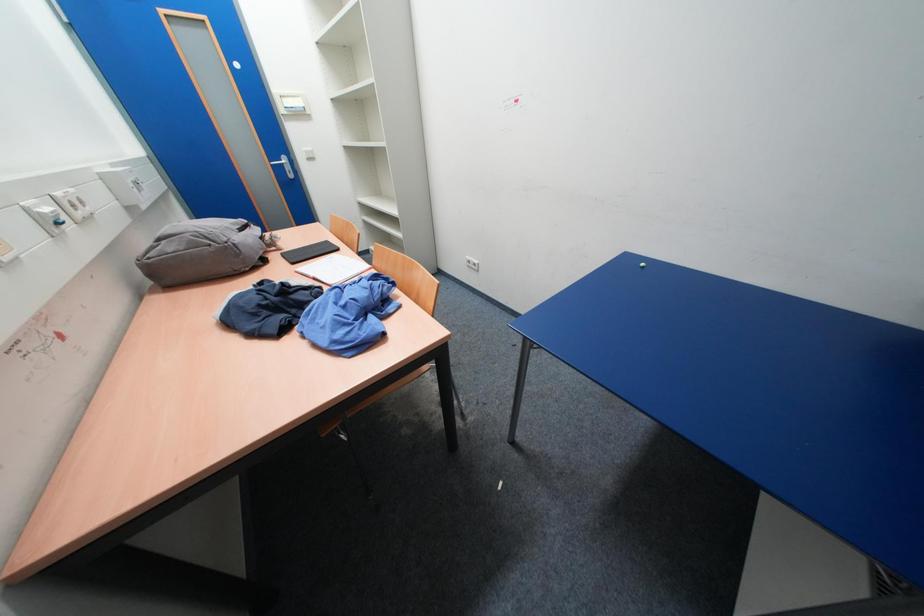
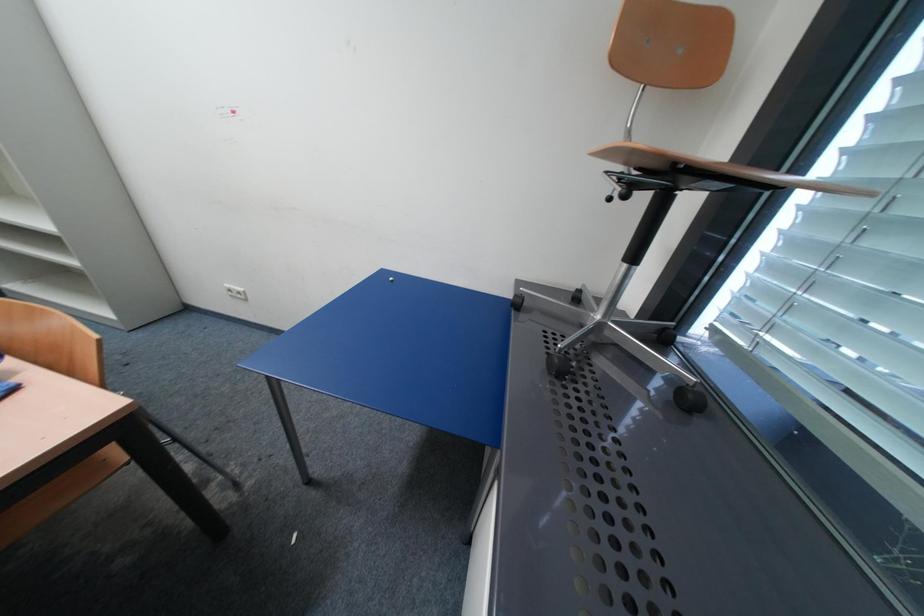
Question: The camera is either moving clockwise (left) or counter-clockwise (right) around the object. The first image is from the beginning of the video and the second image is from the end. Is the camera moving left or right when shooting the video?

Choices:
 (A) Left
 (B) Right

Answer: (A)